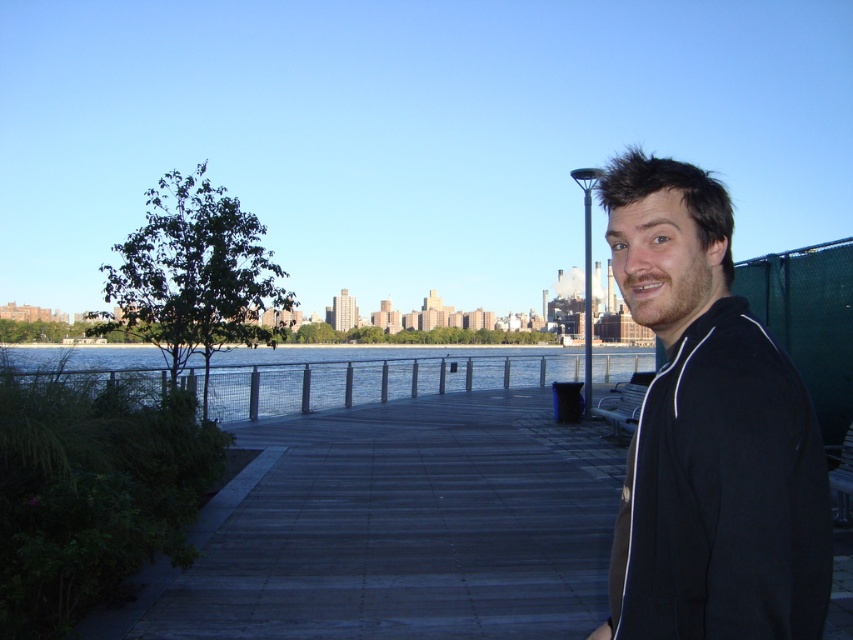
Question: Can you confirm if wooden planks at center is smaller than black zip-up jacket at right?

Choices:
 (A) yes
 (B) no

Answer: (B)

Question: Considering the relative positions of black zip-up jacket at right and clear water at center in the image provided, where is black zip-up jacket at right located with respect to clear water at center?

Choices:
 (A) below
 (B) above

Answer: (B)

Question: Which point is closer to the camera?

Choices:
 (A) black zip-up jacket at right
 (B) wooden planks at center
 (C) clear water at center

Answer: (A)

Question: Is black zip-up jacket at right above clear water at center?

Choices:
 (A) yes
 (B) no

Answer: (A)

Question: Which point is farther from the camera taking this photo?

Choices:
 (A) (175, 381)
 (B) (361, 477)
 (C) (613, 188)

Answer: (A)

Question: Which point is closer to the camera?

Choices:
 (A) clear water at center
 (B) black zip-up jacket at right
 (C) wooden planks at center

Answer: (B)